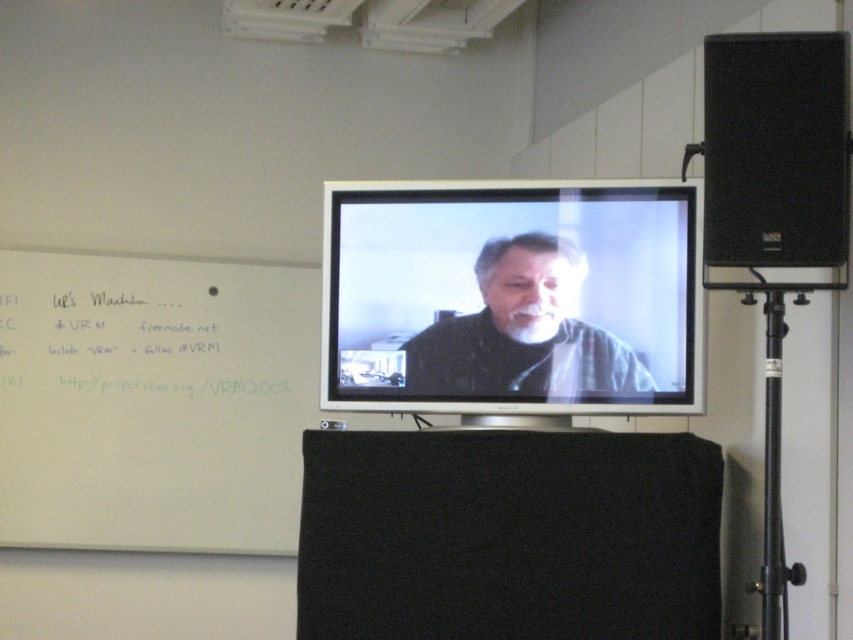
Who is taller, black foam speaker at upper right or matte black shirt at center?

black foam speaker at upper right is taller.

Does black foam speaker at upper right have a lesser height compared to matte black shirt at center?

Incorrect, black foam speaker at upper right's height does not fall short of matte black shirt at center's.

Who is more forward, (738, 244) or (550, 381)?

Point (738, 244) is more forward.

The height and width of the screenshot is (640, 853). I want to click on black foam speaker at upper right, so click(x=775, y=148).

Can you confirm if black fabric at lower center is positioned above white paper at upper left?

Actually, black fabric at lower center is below white paper at upper left.

Can you confirm if black fabric at lower center is smaller than white paper at upper left?

No.

At what (x,y) coordinates should I click in order to perform the action: click on black fabric at lower center. Please return your answer as a coordinate pair (x, y). This screenshot has height=640, width=853. Looking at the image, I should click on (508, 536).

The height and width of the screenshot is (640, 853). In order to click on black fabric at lower center in this screenshot , I will do `click(508, 536)`.

Between black fabric at lower center and matte silver tv at center, which one is positioned lower?

black fabric at lower center is lower down.

Does black fabric at lower center have a greater height compared to matte silver tv at center?

No, black fabric at lower center is not taller than matte silver tv at center.

The height and width of the screenshot is (640, 853). Identify the location of black fabric at lower center. (508, 536).